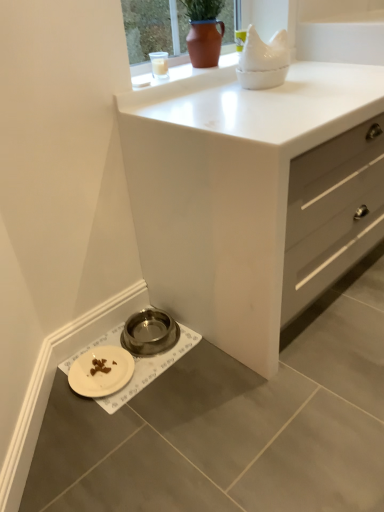
Question: Should I look upward or downward to see matte brown pot at upper center?

Choices:
 (A) down
 (B) up

Answer: (B)

Question: Does white matte chest of drawers at center have a lesser width compared to metallic bowl at lower left?

Choices:
 (A) yes
 (B) no

Answer: (B)

Question: Is white matte chest of drawers at center with metallic bowl at lower left?

Choices:
 (A) yes
 (B) no

Answer: (B)

Question: Is white matte chest of drawers at center turned away from metallic bowl at lower left?

Choices:
 (A) yes
 (B) no

Answer: (B)

Question: Considering the relative positions of white matte chest of drawers at center and metallic bowl at lower left in the image provided, is white matte chest of drawers at center in front of metallic bowl at lower left?

Choices:
 (A) yes
 (B) no

Answer: (A)

Question: From the image's perspective, is white matte chest of drawers at center on top of metallic bowl at lower left?

Choices:
 (A) yes
 (B) no

Answer: (A)

Question: Is white matte chest of drawers at center to the left of metallic bowl at lower left from the viewer's perspective?

Choices:
 (A) yes
 (B) no

Answer: (B)

Question: From a real-world perspective, is matte brown pot at upper center under white matte chest of drawers at center?

Choices:
 (A) no
 (B) yes

Answer: (A)

Question: Can you confirm if matte brown pot at upper center is shorter than white matte chest of drawers at center?

Choices:
 (A) no
 (B) yes

Answer: (B)

Question: Does matte brown pot at upper center appear on the left side of white matte chest of drawers at center?

Choices:
 (A) no
 (B) yes

Answer: (B)

Question: Does matte brown pot at upper center have a greater width compared to white matte chest of drawers at center?

Choices:
 (A) no
 (B) yes

Answer: (A)

Question: From the image's perspective, is matte brown pot at upper center under white matte chest of drawers at center?

Choices:
 (A) yes
 (B) no

Answer: (B)

Question: Considering the relative sizes of matte brown pot at upper center and white matte chest of drawers at center in the image provided, is matte brown pot at upper center thinner than white matte chest of drawers at center?

Choices:
 (A) yes
 (B) no

Answer: (A)

Question: Does white matte chest of drawers at center have a larger size compared to matte brown pot at upper center?

Choices:
 (A) yes
 (B) no

Answer: (A)